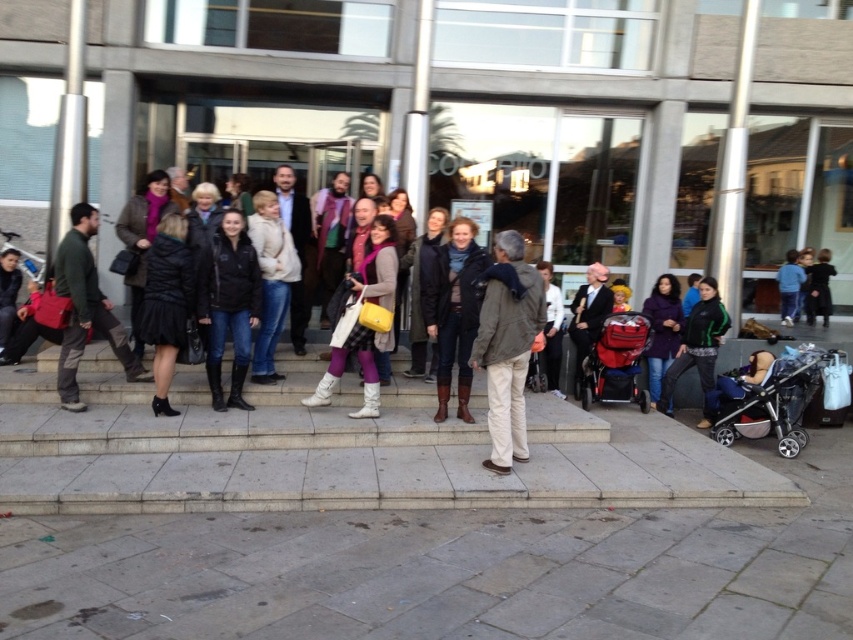
Question: Considering the relative positions of leather boots at center and red plastic baby carriage at center in the image provided, where is leather boots at center located with respect to red plastic baby carriage at center?

Choices:
 (A) above
 (B) below

Answer: (A)

Question: Considering the relative positions of matte yellow bag at center and red plastic baby carriage at center in the image provided, where is matte yellow bag at center located with respect to red plastic baby carriage at center?

Choices:
 (A) above
 (B) below

Answer: (A)

Question: Is khaki cotton jacket at center above purple matte jacket at center?

Choices:
 (A) no
 (B) yes

Answer: (A)

Question: Which of these objects is positioned farthest from the purple matte jacket at center?

Choices:
 (A) dark gray suit at center
 (B) matte yellow bag at center
 (C) metallic silver stroller at lower right
 (D) light beige coat at center

Answer: (D)

Question: Estimate the real-world distances between objects in this image. Which object is closer to the black velvet dress at center?

Choices:
 (A) matte black jacket at center
 (B) light beige coat at center
 (C) dark gray suit at center
 (D) red plastic baby carriage at center

Answer: (C)

Question: Which point is farther from the camera taking this photo?

Choices:
 (A) (688, 336)
 (B) (450, 324)

Answer: (A)